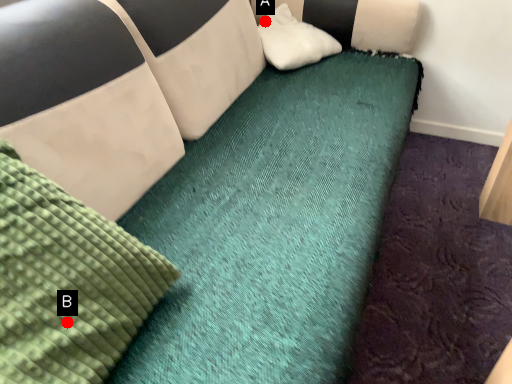
Question: Two points are circled on the image, labeled by A and B beside each circle. Which point is closer to the camera?

Choices:
 (A) A is closer
 (B) B is closer

Answer: (B)